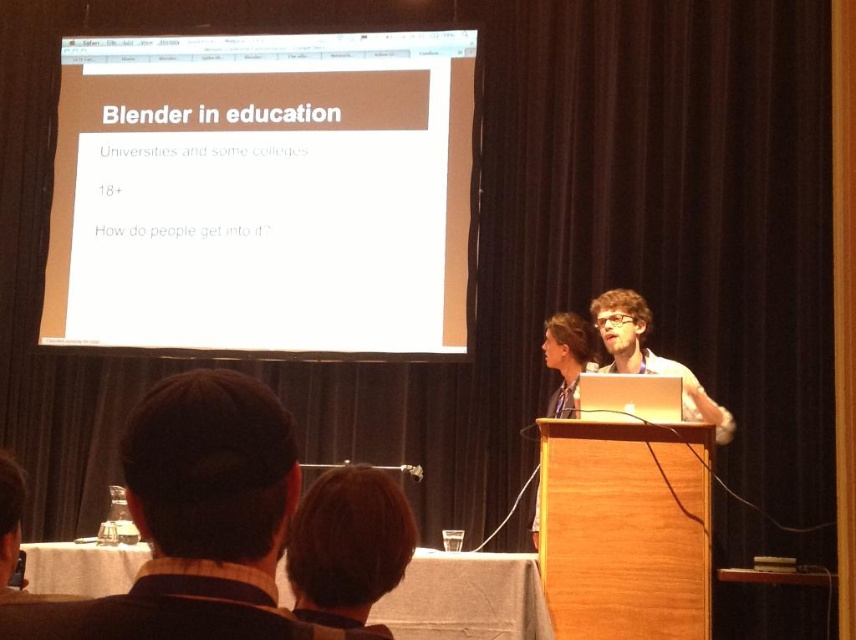
Which of these two, matte white laptop at center or matte black hair at center, stands shorter?

matte black hair at center

Is point (610, 355) positioned behind point (569, 365)?

No.

Where is `matte white laptop at center`? This screenshot has height=640, width=856. matte white laptop at center is located at coordinates (649, 355).

Between dark brown hair at lower center and matte black hair at center, which one is positioned lower?

Positioned lower is matte black hair at center.

Does point (152, 460) lie in front of point (535, 524)?

Yes, point (152, 460) is in front of point (535, 524).

This screenshot has height=640, width=856. Find the location of `dark brown hair at lower center`. dark brown hair at lower center is located at coordinates (197, 522).

Find the location of a particular element. dark brown hair at lower center is located at coordinates (197, 522).

Is white paper at upper center positioned in front of matte white laptop at center?

No, it is not.

Is the position of white paper at upper center more distant than that of matte white laptop at center?

Yes, it is.

What do you see at coordinates (262, 193) in the screenshot? The image size is (856, 640). I see `white paper at upper center` at bounding box center [262, 193].

Where is `white paper at upper center`? Image resolution: width=856 pixels, height=640 pixels. white paper at upper center is located at coordinates (262, 193).